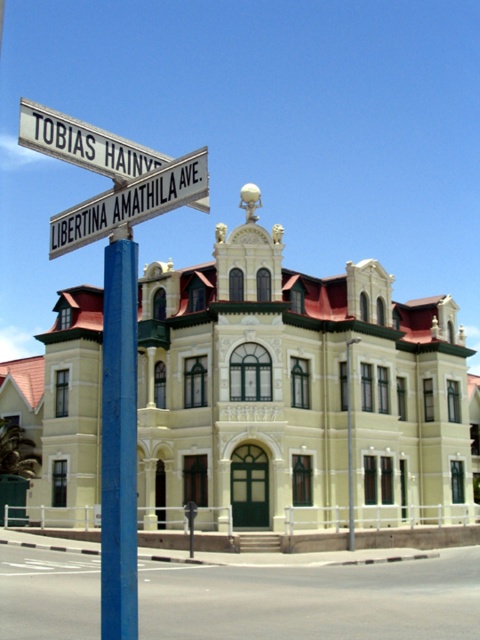
Question: Can you confirm if blue painted metal pole at center is positioned to the left of white plastic street sign at upper center?

Choices:
 (A) no
 (B) yes

Answer: (A)

Question: Which point is closer to the camera?

Choices:
 (A) blue painted metal pole at center
 (B) white plastic street sign at upper center

Answer: (A)

Question: Which of the following is the closest to the observer?

Choices:
 (A) blue painted metal pole at center
 (B) white plastic street sign at upper center

Answer: (A)

Question: Does blue painted metal pole at center have a larger size compared to white plastic street sign at upper center?

Choices:
 (A) no
 (B) yes

Answer: (A)

Question: Is blue painted metal pole at center wider than white plastic street sign at upper center?

Choices:
 (A) yes
 (B) no

Answer: (B)